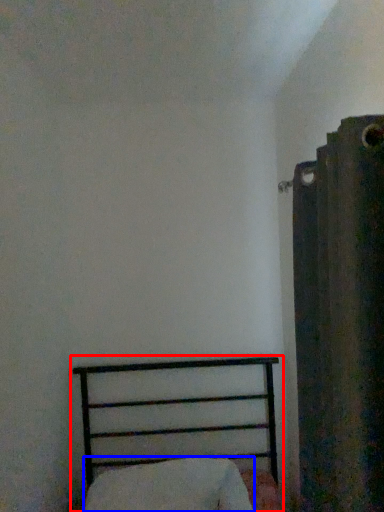
Question: Which of the following is the farthest to the observer, bed (highlighted by a red box) or pillow (highlighted by a blue box)?

Choices:
 (A) bed
 (B) pillow

Answer: (B)